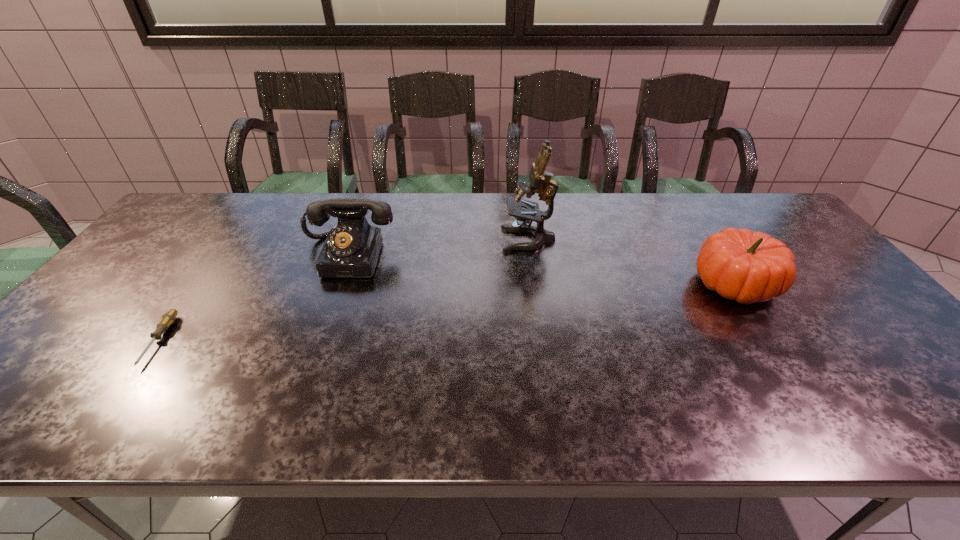
The image size is (960, 540). I want to click on microscope, so click(x=541, y=182).

Where is `the third object from left to right`? the third object from left to right is located at coordinates (541, 182).

The image size is (960, 540). Find the location of `the third object from right to left`. the third object from right to left is located at coordinates (351, 250).

Where is `pumpkin`? This screenshot has height=540, width=960. pumpkin is located at coordinates (741, 265).

Find the location of `the shortest object`. the shortest object is located at coordinates (167, 319).

Locate an element on the screen. the nearest object is located at coordinates (167, 319).

What are the coordinates of `vacant space located at the eyepieces of the tallest object` in the screenshot? It's located at (420, 240).

Image resolution: width=960 pixels, height=540 pixels. In order to click on blank space located at the eyepieces of the tallest object in this screenshot , I will do `click(446, 240)`.

The image size is (960, 540). I want to click on vacant space located at the eyepieces of the tallest object, so click(463, 240).

Image resolution: width=960 pixels, height=540 pixels. In order to click on vacant space situated 0.380m on the dial of the telephone in this screenshot , I will do `click(297, 399)`.